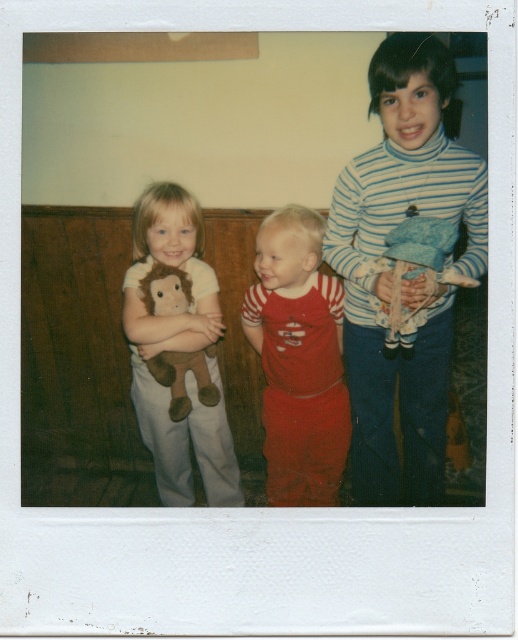
Which of these two, blue striped sweater at upper right or red cotton overalls at center, stands taller?

Standing taller between the two is blue striped sweater at upper right.

From the picture: Who is more forward, (405, 413) or (326, 336)?

Point (326, 336) is more forward.

Is point (369, 180) less distant than point (271, 444)?

That is True.

I want to click on blue striped sweater at upper right, so click(391, 269).

Who is positioned more to the right, red cotton overalls at center or soft brown plush monkey at left?

red cotton overalls at center

Does red cotton overalls at center appear on the left side of soft brown plush monkey at left?

In fact, red cotton overalls at center is to the right of soft brown plush monkey at left.

Between point (290, 372) and point (152, 438), which one is positioned in front?

Point (290, 372) is in front.

The height and width of the screenshot is (640, 518). Identify the location of red cotton overalls at center. (298, 358).

Looking at this image, does red cotton overalls at center lie behind blue fabric doll at right?

That is True.

Is red cotton overalls at center shorter than blue fabric doll at right?

No, red cotton overalls at center is not shorter than blue fabric doll at right.

Describe the element at coordinates (298, 358) in the screenshot. I see `red cotton overalls at center` at that location.

At what (x,y) coordinates should I click in order to perform the action: click on red cotton overalls at center. Please return your answer as a coordinate pair (x, y). This screenshot has height=640, width=518. Looking at the image, I should click on (298, 358).